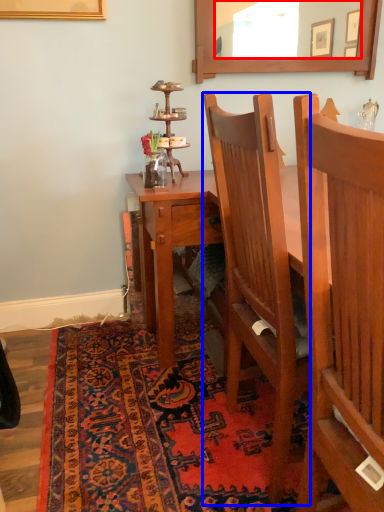
Question: Which object is further to the camera taking this photo, mirror (highlighted by a red box) or chair (highlighted by a blue box)?

Choices:
 (A) mirror
 (B) chair

Answer: (A)